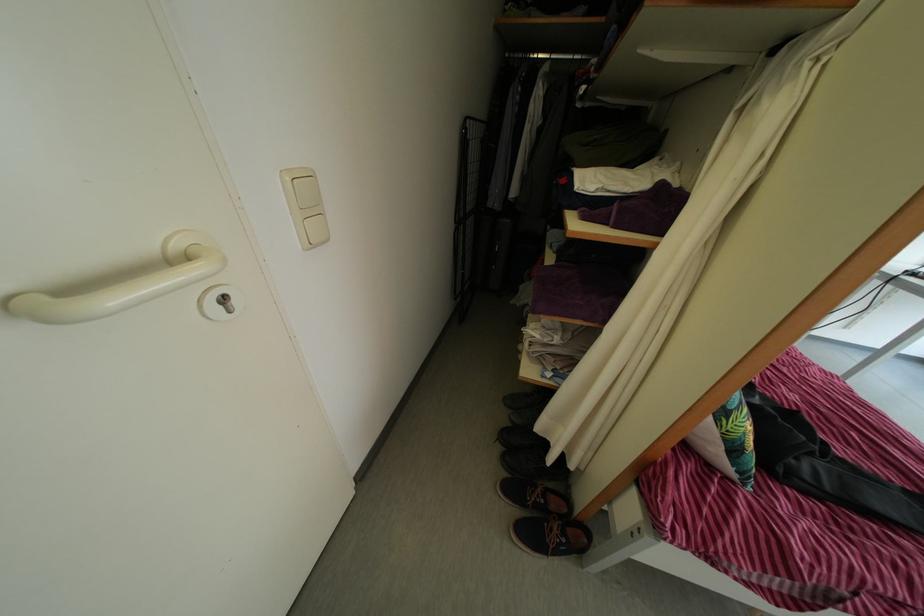
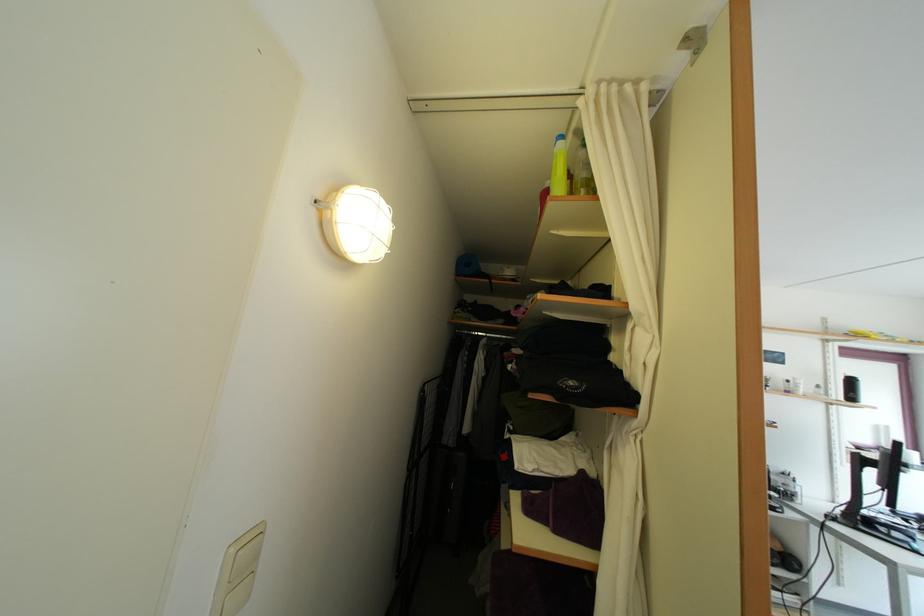
Question: Based on the continuous images, in which direction is the camera rotating? Reply with the corresponding letter.

Choices:
 (A) Left
 (B) Right
 (C) Up
 (D) Down

Answer: (C)